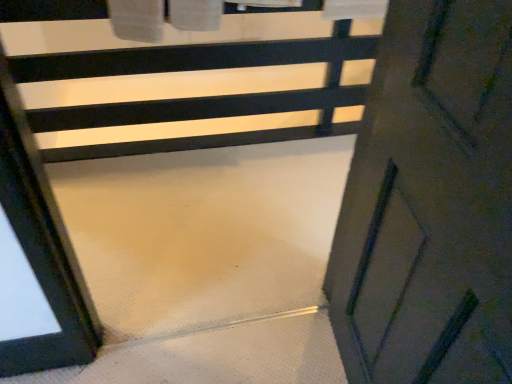
Question: Can you confirm if matte white door at lower right is bigger than white matte stair at center?

Choices:
 (A) no
 (B) yes

Answer: (A)

Question: From the image's perspective, is matte white door at lower right located above white matte stair at center?

Choices:
 (A) no
 (B) yes

Answer: (A)

Question: Does matte white door at lower right appear on the left side of white matte stair at center?

Choices:
 (A) no
 (B) yes

Answer: (A)

Question: Is matte white door at lower right thinner than white matte stair at center?

Choices:
 (A) yes
 (B) no

Answer: (A)

Question: Is matte white door at lower right far from white matte stair at center?

Choices:
 (A) yes
 (B) no

Answer: (A)

Question: Can we say matte white door at lower right lies outside white matte stair at center?

Choices:
 (A) yes
 (B) no

Answer: (A)

Question: Can you confirm if white matte stair at center is bigger than matte white door at lower right?

Choices:
 (A) yes
 (B) no

Answer: (A)

Question: From a real-world perspective, is white matte stair at center on matte white door at lower right?

Choices:
 (A) no
 (B) yes

Answer: (A)

Question: From the image's perspective, is white matte stair at center beneath matte white door at lower right?

Choices:
 (A) no
 (B) yes

Answer: (A)

Question: Considering the relative sizes of white matte stair at center and matte white door at lower right in the image provided, is white matte stair at center shorter than matte white door at lower right?

Choices:
 (A) yes
 (B) no

Answer: (A)

Question: From a real-world perspective, is white matte stair at center positioned under matte white door at lower right based on gravity?

Choices:
 (A) yes
 (B) no

Answer: (A)

Question: From the image's perspective, is white matte stair at center above matte white door at lower right?

Choices:
 (A) no
 (B) yes

Answer: (B)

Question: Considering the relative positions of matte white door at lower right and white matte stair at center in the image provided, is matte white door at lower right to the left or to the right of white matte stair at center?

Choices:
 (A) left
 (B) right

Answer: (B)